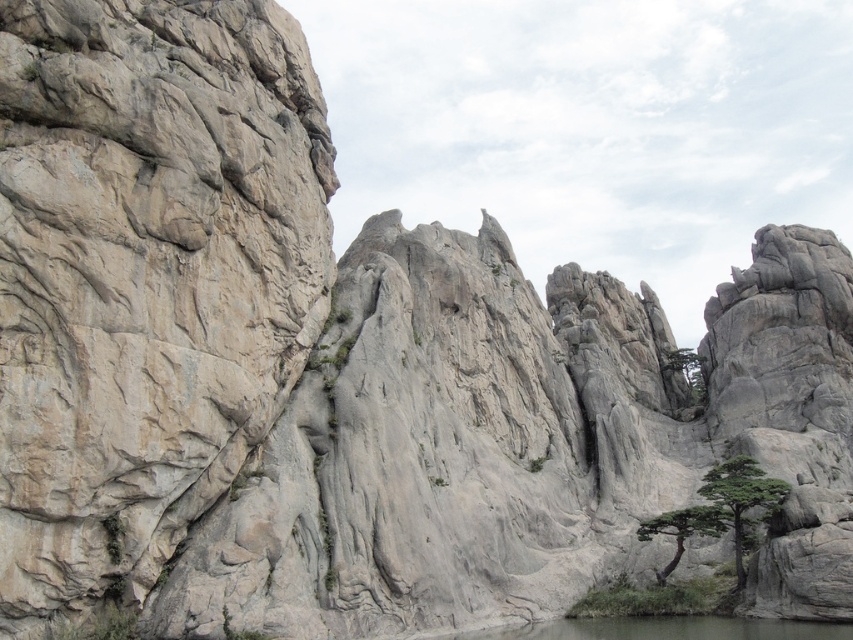
You are standing at the origin point in the image. Which direction should you move to reach the clear water at lower center?

The clear water at lower center is located at coordinates approximately 0.983 on the x axis and 0.782 on the y axis. Since you are at the origin, you should move to the right and slightly upwards to reach it.

You are a hiker who wants to place a small flag on the highest point between the green textured rock at lower right and the green textured tree at lower right. Which object should you choose?

The green textured rock at lower right is positioned over the green textured tree at lower right, so the highest point is the green textured rock at lower right.

In the scene shown: You are planning to place a small garden statue that requires a base of at least 1 meter in width. Looking at the green textured rock at lower right and the green textured tree at lower right, which one would be suitable as a base for the statue?

The green textured rock at lower right has a larger size compared to the green textured tree at lower right, so it would be suitable as a base for the statue since it can provide the required 1 meter width.